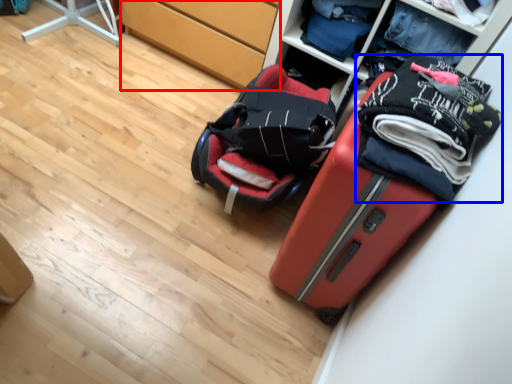
Question: Among these objects, which one is farthest to the camera, cabinetry (highlighted by a red box) or clothing (highlighted by a blue box)?

Choices:
 (A) cabinetry
 (B) clothing

Answer: (A)